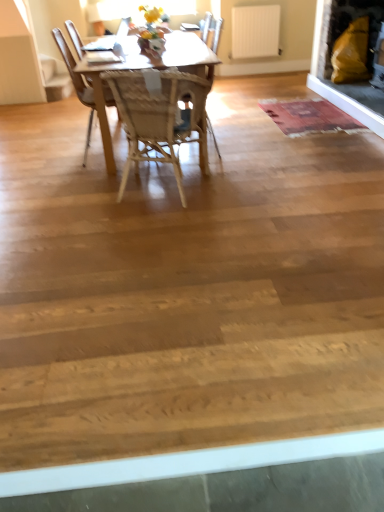
Question: Is matte yellow cushion at upper right bigger than woven wood chair at center, the 2th chair when ordered from back to front?

Choices:
 (A) yes
 (B) no

Answer: (A)

Question: Can you confirm if matte yellow cushion at upper right is shorter than woven wood chair at center, the 2th chair when ordered from back to front?

Choices:
 (A) no
 (B) yes

Answer: (A)

Question: Can you confirm if matte yellow cushion at upper right is positioned to the left of woven wood chair at center, which is the first chair from front to back?

Choices:
 (A) yes
 (B) no

Answer: (B)

Question: Would you say matte yellow cushion at upper right contains woven wood chair at center, which is the first chair from front to back?

Choices:
 (A) no
 (B) yes

Answer: (A)

Question: Considering the relative sizes of matte yellow cushion at upper right and woven wood chair at center, the 2th chair when ordered from back to front, in the image provided, is matte yellow cushion at upper right thinner than woven wood chair at center, the 2th chair when ordered from back to front,?

Choices:
 (A) no
 (B) yes

Answer: (A)

Question: Is matte yellow cushion at upper right with woven wood chair at center, the 2th chair when ordered from back to front?

Choices:
 (A) no
 (B) yes

Answer: (A)

Question: Is the surface of woven wood chair at center, which is the first chair from front to back, in direct contact with matte yellow cushion at upper right?

Choices:
 (A) no
 (B) yes

Answer: (A)

Question: Can we say woven wood chair at center, the 2th chair when ordered from back to front, lies outside matte yellow cushion at upper right?

Choices:
 (A) yes
 (B) no

Answer: (A)

Question: Considering the relative sizes of woven wood chair at center, the 2th chair when ordered from back to front, and matte yellow cushion at upper right in the image provided, is woven wood chair at center, the 2th chair when ordered from back to front, smaller than matte yellow cushion at upper right?

Choices:
 (A) no
 (B) yes

Answer: (B)

Question: From the image's perspective, is woven wood chair at center, the 2th chair when ordered from back to front, above matte yellow cushion at upper right?

Choices:
 (A) yes
 (B) no

Answer: (B)

Question: Does woven wood chair at center, the 2th chair when ordered from back to front, appear on the right side of matte yellow cushion at upper right?

Choices:
 (A) no
 (B) yes

Answer: (A)

Question: Does woven wood chair at center, the 2th chair when ordered from back to front, have a greater width compared to matte yellow cushion at upper right?

Choices:
 (A) no
 (B) yes

Answer: (A)

Question: Is wooden chair at center, the 1th chair viewed from the back, taller than rustic woolen mat at center?

Choices:
 (A) yes
 (B) no

Answer: (A)